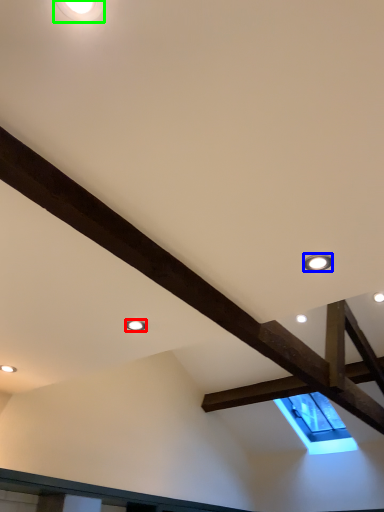
Question: Based on their relative distances, which object is farther from droplight (highlighted by a red box)? Choose from droplight (highlighted by a blue box) and droplight (highlighted by a green box).

Choices:
 (A) droplight
 (B) droplight

Answer: (B)